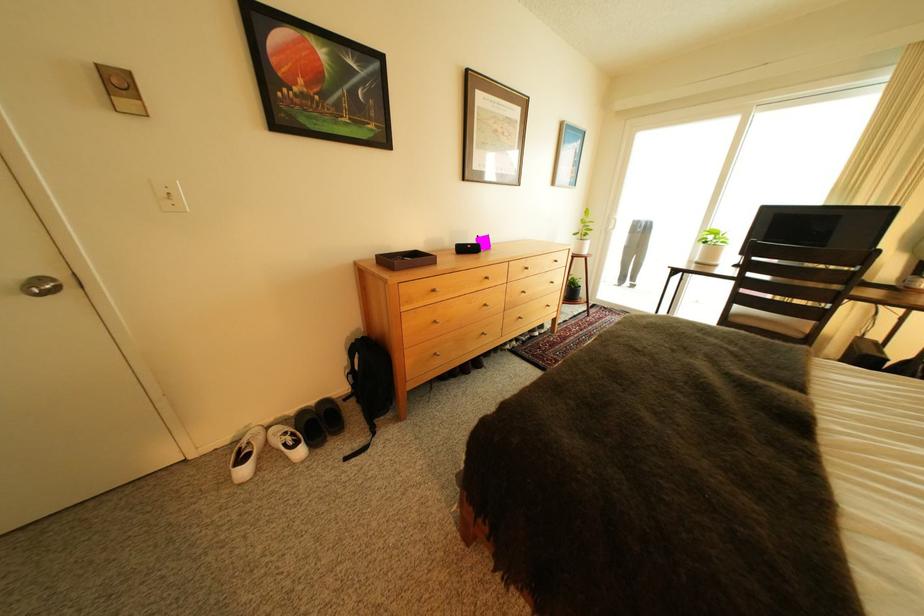
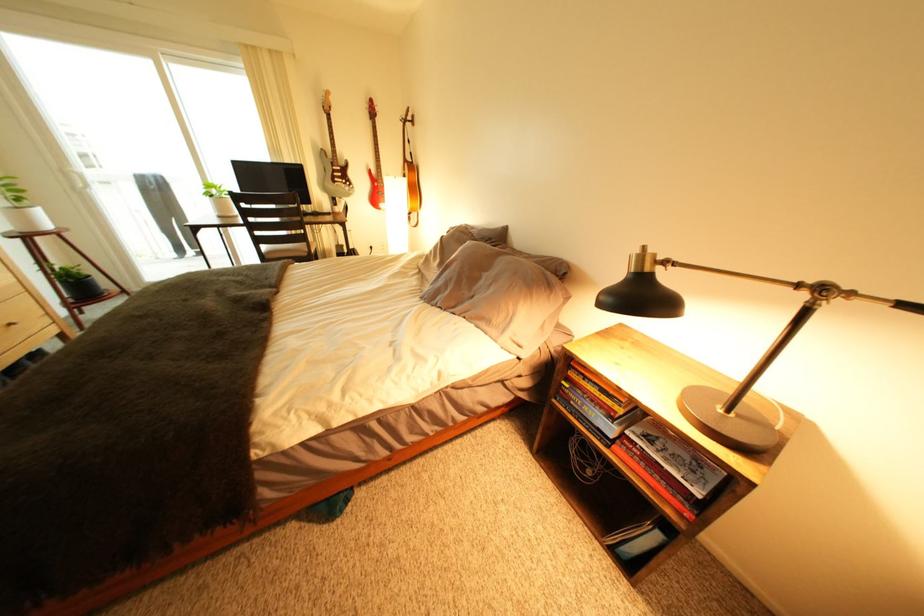
In the second image, find the point that corresponds to [718,244] in the first image.

(225, 198)